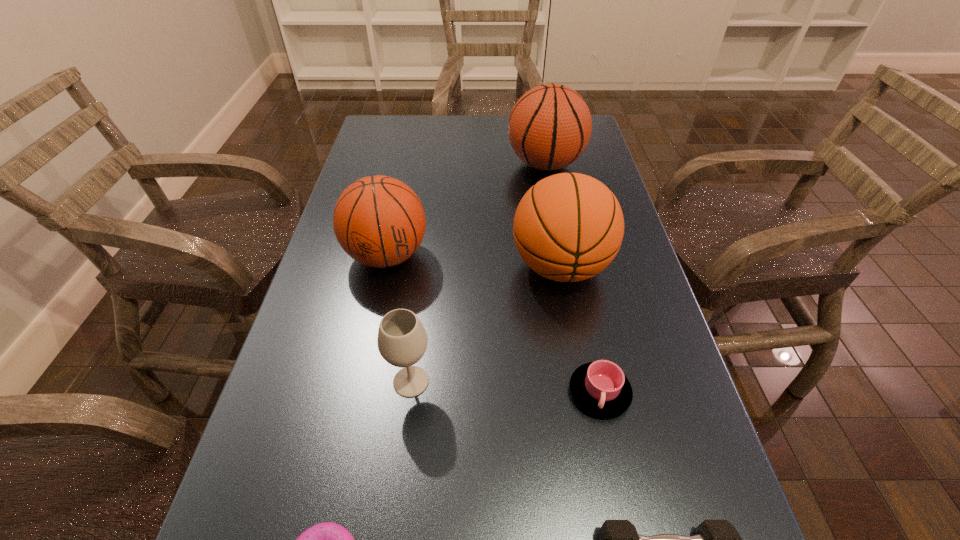
Where is `the farthest basketball`? The height and width of the screenshot is (540, 960). the farthest basketball is located at coordinates (549, 127).

Where is `the leftmost basketball`? the leftmost basketball is located at coordinates (379, 221).

Identify the location of wineglass. This screenshot has height=540, width=960. (402, 340).

Where is `cup`? Image resolution: width=960 pixels, height=540 pixels. cup is located at coordinates (601, 388).

This screenshot has width=960, height=540. Identify the location of vacant space located 0.210m on the side where the inflation valve is located. (436, 165).

The height and width of the screenshot is (540, 960). I want to click on vacant area situated on the side where the inflation valve is located, so click(x=452, y=165).

This screenshot has width=960, height=540. I want to click on free space located on the side where the inflation valve is located, so click(x=456, y=165).

The image size is (960, 540). What are the coordinates of `free space located on the right of the leftmost basketball` in the screenshot? It's located at (497, 255).

This screenshot has width=960, height=540. In order to click on free space located 0.190m on the front of the fourth shortest object in this screenshot , I will do `click(394, 521)`.

Locate an element on the screen. vacant area located on the side with the handle of the cup is located at coordinates (615, 469).